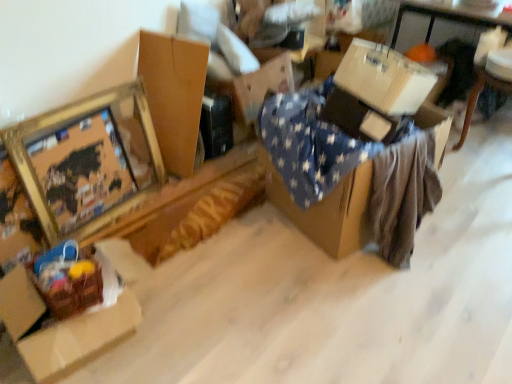
The height and width of the screenshot is (384, 512). What do you see at coordinates (174, 95) in the screenshot? I see `brown cardboard box at upper left, which is the 2th cardboard box from right to left` at bounding box center [174, 95].

Locate an element on the screen. Image resolution: width=512 pixels, height=384 pixels. white corrugated cardboard box at upper right, acting as the third cardboard box starting from the left is located at coordinates (384, 78).

This screenshot has width=512, height=384. What do you see at coordinates (61, 328) in the screenshot?
I see `brown cardboard box at lower left, which is the 3th cardboard box in right-to-left order` at bounding box center [61, 328].

What do you see at coordinates (450, 16) in the screenshot? The height and width of the screenshot is (384, 512). I see `white cardboard box at upper right, which is the 2th table in left-to-right order` at bounding box center [450, 16].

The height and width of the screenshot is (384, 512). What are the coordinates of `brown cardboard box at upper left, which is the second cardboard box in left-to-right order` in the screenshot? It's located at pos(174,95).

Is white cardboard box at upper right, the 1th table when ordered from right to left, surrounded by white corrugated cardboard box at upper right, the 1th cardboard box positioned from the right?

No, white cardboard box at upper right, the 1th table when ordered from right to left, is located outside of white corrugated cardboard box at upper right, the 1th cardboard box positioned from the right.

Does white corrugated cardboard box at upper right, acting as the third cardboard box starting from the left, lie in front of white cardboard box at upper right, which is the 2th table in left-to-right order?

Yes, white corrugated cardboard box at upper right, acting as the third cardboard box starting from the left, is closer to the viewer.

In the scene shown: Which point is more forward, [435,77] or [401,10]?

The point [435,77] is closer to the camera.

Based on the photo, who is taller, blue star-patterned fabric at center, acting as the 2th table starting from the right, or brown cardboard box at lower left, which is the 3th cardboard box in right-to-left order?

blue star-patterned fabric at center, acting as the 2th table starting from the right, is taller.

Can you confirm if blue star-patterned fabric at center, arranged as the first table when viewed from the front, is wider than brown cardboard box at lower left, which is the first cardboard box from left to right?

Yes.

From a real-world perspective, is blue star-patterned fabric at center, positioned as the 2th table in back-to-front order, over brown cardboard box at lower left, which is the 3th cardboard box in right-to-left order?

Yes, from a real-world perspective, blue star-patterned fabric at center, positioned as the 2th table in back-to-front order, is above brown cardboard box at lower left, which is the 3th cardboard box in right-to-left order.

In the image, is brown cardboard box at lower left, which is the 3th cardboard box in right-to-left order, positioned in front of or behind white corrugated cardboard box at upper right, the 1th cardboard box positioned from the right?

brown cardboard box at lower left, which is the 3th cardboard box in right-to-left order, is in front of white corrugated cardboard box at upper right, the 1th cardboard box positioned from the right.

Is brown cardboard box at lower left, which is the first cardboard box from left to right, not near white corrugated cardboard box at upper right, acting as the third cardboard box starting from the left?

brown cardboard box at lower left, which is the first cardboard box from left to right, is far away from white corrugated cardboard box at upper right, acting as the third cardboard box starting from the left.

Considering the sizes of objects brown cardboard box at lower left, which is the 3th cardboard box in right-to-left order, and white corrugated cardboard box at upper right, the 1th cardboard box positioned from the right, in the image provided, who is wider, brown cardboard box at lower left, which is the 3th cardboard box in right-to-left order, or white corrugated cardboard box at upper right, the 1th cardboard box positioned from the right,?

With larger width is brown cardboard box at lower left, which is the 3th cardboard box in right-to-left order.

How much distance is there between brown cardboard box at lower left, which is the 3th cardboard box in right-to-left order, and white corrugated cardboard box at upper right, acting as the third cardboard box starting from the left?

A distance of 4.35 feet exists between brown cardboard box at lower left, which is the 3th cardboard box in right-to-left order, and white corrugated cardboard box at upper right, acting as the third cardboard box starting from the left.

Between white corrugated cardboard box at upper right, acting as the third cardboard box starting from the left, and gold metallic picture frame at upper left, which one has less height?

Standing shorter between the two is white corrugated cardboard box at upper right, acting as the third cardboard box starting from the left.

Which is correct: white corrugated cardboard box at upper right, acting as the third cardboard box starting from the left, is inside gold metallic picture frame at upper left, or outside of it?

white corrugated cardboard box at upper right, acting as the third cardboard box starting from the left, is not enclosed by gold metallic picture frame at upper left.

From a real-world perspective, is white corrugated cardboard box at upper right, acting as the third cardboard box starting from the left, above or below gold metallic picture frame at upper left?

From a real-world perspective, white corrugated cardboard box at upper right, acting as the third cardboard box starting from the left, is physically above gold metallic picture frame at upper left.

Between blue star-patterned fabric at center, acting as the 2th table starting from the right, and gold metallic picture frame at upper left, which one has more height?

gold metallic picture frame at upper left.

Is point (325, 134) in front of point (21, 166)?

Yes, point (325, 134) is in front of point (21, 166).

Is gold metallic picture frame at upper left at the back of blue star-patterned fabric at center, arranged as the first table when viewed from the front?

That's not correct — blue star-patterned fabric at center, arranged as the first table when viewed from the front, is not looking away from gold metallic picture frame at upper left.

Find the location of a particular element. This screenshot has height=384, width=512. cardboard box that is the 2nd one below the gold metallic picture frame at upper left (from a real-world perspective) is located at coordinates (61, 328).

Is brown cardboard box at lower left, which is the 3th cardboard box in right-to-left order, a part of gold metallic picture frame at upper left?

Definitely not — brown cardboard box at lower left, which is the 3th cardboard box in right-to-left order, is not inside gold metallic picture frame at upper left.

Can you confirm if gold metallic picture frame at upper left is positioned to the left of brown cardboard box at lower left, which is the 3th cardboard box in right-to-left order?

Yes.

Is gold metallic picture frame at upper left oriented away from brown cardboard box at lower left, which is the 3th cardboard box in right-to-left order?

No.

Is brown cardboard box at upper left, which is the second cardboard box in left-to-right order, facing away from white corrugated cardboard box at upper right, acting as the third cardboard box starting from the left?

No, brown cardboard box at upper left, which is the second cardboard box in left-to-right order,'s orientation is not away from white corrugated cardboard box at upper right, acting as the third cardboard box starting from the left.

Which of these two, brown cardboard box at upper left, which is the 2th cardboard box from right to left, or white corrugated cardboard box at upper right, the 1th cardboard box positioned from the right, stands taller?

brown cardboard box at upper left, which is the 2th cardboard box from right to left, is taller.

Is brown cardboard box at upper left, which is the second cardboard box in left-to-right order, with white corrugated cardboard box at upper right, acting as the third cardboard box starting from the left?

brown cardboard box at upper left, which is the second cardboard box in left-to-right order, and white corrugated cardboard box at upper right, acting as the third cardboard box starting from the left, are clearly separated.

Identify the location of the 1st cardboard box to the left when counting from the white cardboard box at upper right, acting as the 2th table starting from the front. (384, 78).

This screenshot has height=384, width=512. In order to click on the 1st table behind when counting from the brown cardboard box at lower left, which is the 3th cardboard box in right-to-left order in this screenshot , I will do pos(351,177).

Which object lies nearer to the anchor point brown cardboard box at lower left, which is the first cardboard box from left to right, brown cardboard box at upper left, which is the second cardboard box in left-to-right order, or blue star-patterned fabric at center, arranged as the first table when viewed from the front?

blue star-patterned fabric at center, arranged as the first table when viewed from the front, is positioned closer to the anchor brown cardboard box at lower left, which is the first cardboard box from left to right.

From the image, which object appears to be nearer to white cardboard box at upper right, which is the 2th table in left-to-right order, brown cardboard box at upper left, which is the second cardboard box in left-to-right order, or brown cardboard box at lower left, which is the first cardboard box from left to right?

brown cardboard box at upper left, which is the second cardboard box in left-to-right order, lies closer to white cardboard box at upper right, which is the 2th table in left-to-right order, than the other object.

Estimate the real-world distances between objects in this image. Which object is closer to brown cardboard box at lower left, which is the 3th cardboard box in right-to-left order, white cardboard box at upper right, which is counted as the 1th table, starting from the back, or white corrugated cardboard box at upper right, acting as the third cardboard box starting from the left?

white corrugated cardboard box at upper right, acting as the third cardboard box starting from the left, is closer to brown cardboard box at lower left, which is the 3th cardboard box in right-to-left order.

Estimate the real-world distances between objects in this image. Which object is closer to gold metallic picture frame at upper left, blue star-patterned fabric at center, acting as the 2th table starting from the right, or white cardboard box at upper right, which is counted as the 1th table, starting from the back?

blue star-patterned fabric at center, acting as the 2th table starting from the right.

When comparing their distances from gold metallic picture frame at upper left, does brown cardboard box at upper left, which is the 2th cardboard box from right to left, or blue star-patterned fabric at center, arranged as the first table when viewed from the front, seem closer?

brown cardboard box at upper left, which is the 2th cardboard box from right to left, is closer to gold metallic picture frame at upper left.

Considering their positions, is blue star-patterned fabric at center, arranged as the first table when viewed from the front, positioned closer to white cardboard box at upper right, which is the 2th table in left-to-right order, than white corrugated cardboard box at upper right, acting as the third cardboard box starting from the left?

white corrugated cardboard box at upper right, acting as the third cardboard box starting from the left.

Considering their positions, is white cardboard box at upper right, which is the 2th table in left-to-right order, positioned further to brown cardboard box at upper left, which is the second cardboard box in left-to-right order, than brown cardboard box at lower left, which is the first cardboard box from left to right?

Among the two, white cardboard box at upper right, which is the 2th table in left-to-right order, is located further to brown cardboard box at upper left, which is the second cardboard box in left-to-right order.

Based on their spatial positions, is gold metallic picture frame at upper left or white cardboard box at upper right, acting as the 2th table starting from the front, closer to blue star-patterned fabric at center, positioned as the 2th table in back-to-front order?

The object closer to blue star-patterned fabric at center, positioned as the 2th table in back-to-front order, is gold metallic picture frame at upper left.

You are a GUI agent. You are given a task and a screenshot of the screen. Output one action in this format:
    pyautogui.click(x=<x>, y=<y>)
    Task: Click on the cardboard box located between brown cardboard box at upper left, which is the 2th cardboard box from right to left, and white cardboard box at upper right, which is the 2th table in left-to-right order, in the left-right direction
    This screenshot has height=384, width=512.
    Given the screenshot: What is the action you would take?
    pyautogui.click(x=384, y=78)

The height and width of the screenshot is (384, 512). Find the location of `cardboard box between blue star-patterned fabric at center, positioned as the 2th table in back-to-front order, and white cardboard box at upper right, the 1th table when ordered from right to left, in the horizontal direction`. cardboard box between blue star-patterned fabric at center, positioned as the 2th table in back-to-front order, and white cardboard box at upper right, the 1th table when ordered from right to left, in the horizontal direction is located at coordinates (384, 78).

Locate an element on the screen. Image resolution: width=512 pixels, height=384 pixels. picture frame located between brown cardboard box at lower left, which is the 3th cardboard box in right-to-left order, and brown cardboard box at upper left, which is the second cardboard box in left-to-right order, in the depth direction is located at coordinates (86, 161).

This screenshot has height=384, width=512. I want to click on table between brown cardboard box at lower left, which is the 3th cardboard box in right-to-left order, and white corrugated cardboard box at upper right, the 1th cardboard box positioned from the right, from left to right, so click(x=351, y=177).